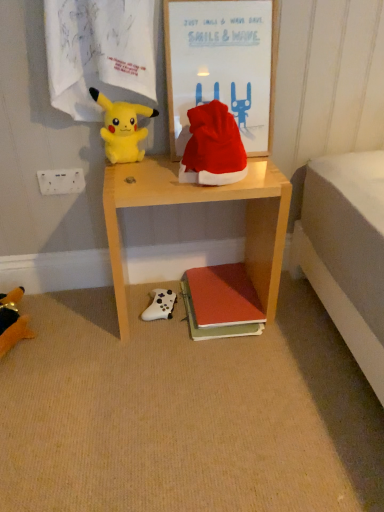
Question: Should I look upward or downward to see white plastic power outlet at upper left?

Choices:
 (A) up
 (B) down

Answer: (A)

Question: From the image's perspective, is red velvet santa hat at center above wooden framed poster at upper center?

Choices:
 (A) yes
 (B) no

Answer: (B)

Question: Can you confirm if red velvet santa hat at center is shorter than wooden framed poster at upper center?

Choices:
 (A) no
 (B) yes

Answer: (B)

Question: From a real-world perspective, is red velvet santa hat at center below wooden framed poster at upper center?

Choices:
 (A) no
 (B) yes

Answer: (B)

Question: Is red velvet santa hat at center completely or partially outside of wooden framed poster at upper center?

Choices:
 (A) no
 (B) yes

Answer: (B)

Question: Can you confirm if red velvet santa hat at center is positioned to the right of wooden framed poster at upper center?

Choices:
 (A) no
 (B) yes

Answer: (A)

Question: From a real-world perspective, does red velvet santa hat at center stand above wooden framed poster at upper center?

Choices:
 (A) yes
 (B) no

Answer: (B)

Question: Is wooden framed poster at upper center thinner than matte orange book at lower center?

Choices:
 (A) yes
 (B) no

Answer: (A)

Question: Does wooden framed poster at upper center have a greater height compared to matte orange book at lower center?

Choices:
 (A) no
 (B) yes

Answer: (B)

Question: Is wooden framed poster at upper center at the right side of matte orange book at lower center?

Choices:
 (A) no
 (B) yes

Answer: (A)

Question: Is wooden framed poster at upper center outside of matte orange book at lower center?

Choices:
 (A) yes
 (B) no

Answer: (A)

Question: Is wooden framed poster at upper center wider than matte orange book at lower center?

Choices:
 (A) yes
 (B) no

Answer: (B)

Question: From a real-world perspective, is wooden framed poster at upper center under matte orange book at lower center?

Choices:
 (A) no
 (B) yes

Answer: (A)

Question: Is soft plush toy at lower left, the 3th toy when ordered from top to bottom, smaller than white matte game controller at lower center, the first toy positioned from the right?

Choices:
 (A) no
 (B) yes

Answer: (A)